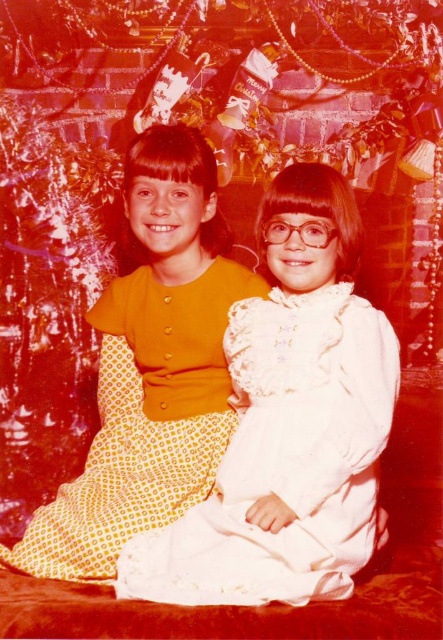
Image resolution: width=443 pixels, height=640 pixels. I want to click on white lace dress at center, so click(x=284, y=460).

Is point (151, 582) behind point (69, 516)?

No, it is in front of (69, 516).

You are a GUI agent. You are given a task and a screenshot of the screen. Output one action in this format:
    pyautogui.click(x=<x>, y=<y>)
    Task: Click on the white lace dress at center
    Image resolution: width=443 pixels, height=640 pixels.
    Given the screenshot: What is the action you would take?
    pyautogui.click(x=284, y=460)